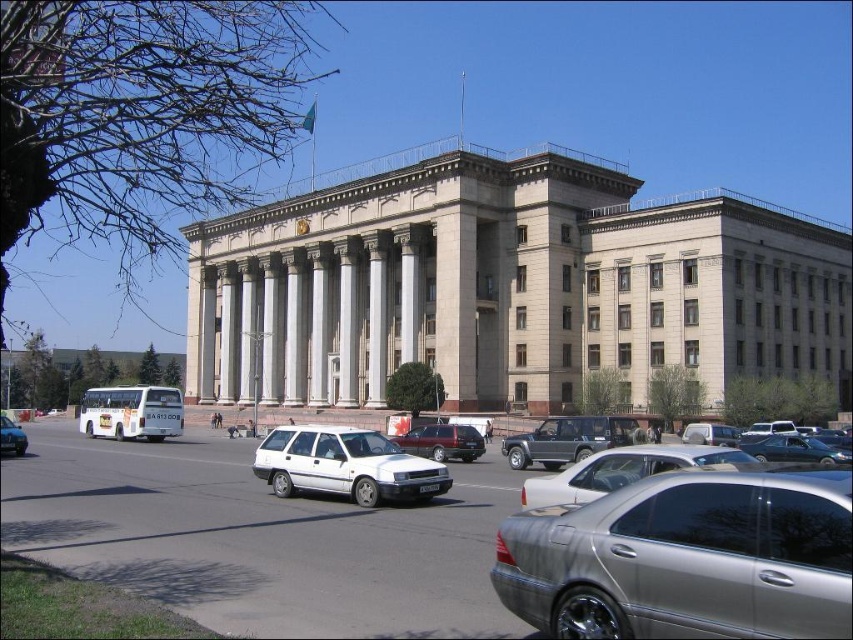
You are a parking attendant who needs to fit both the silver metallic sedan at center and the satin silver sedan at center into a parking spot that can only accommodate one car. Which car should you choose to park?

The satin silver sedan at center is smaller in size than the silver metallic sedan at center, so you should choose to park the satin silver sedan at center as it will fit better in the single parking spot.

You are a delivery person who needs to park your metallic silver station wagon at center as close as possible to the building entrance. The parking area has a 30 meter limit for vehicles. Can you park your vehicle within the allowed distance?

The metallic silver station wagon at center is 56.26 meters away from the building entrance. Since the parking limit is 30 meters, you cannot park within the allowed distance.